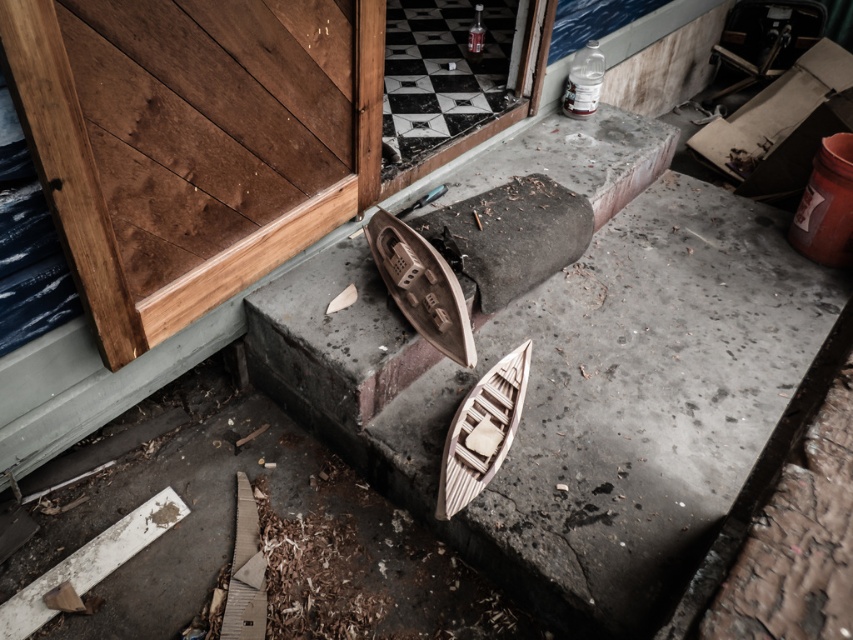
Question: Among these points, which one is farthest from the camera?

Choices:
 (A) coord(662,205)
 (B) coord(447,438)
 (C) coord(366,147)
 (D) coord(439,4)

Answer: (D)

Question: Observing the image, what is the correct spatial positioning of wooden door at left in reference to black glass screen door at upper center?

Choices:
 (A) above
 (B) below

Answer: (B)

Question: Does smooth concrete boat at center lie behind wooden door at left?

Choices:
 (A) no
 (B) yes

Answer: (B)

Question: Among these points, which one is nearest to the camera?

Choices:
 (A) (526, 58)
 (B) (508, 417)

Answer: (B)

Question: Which object appears closest to the camera in this image?

Choices:
 (A) wooden boat at center
 (B) smooth concrete boat at center
 (C) black glass screen door at upper center
 (D) wooden door at left

Answer: (D)

Question: Does smooth concrete boat at center appear over wooden door at left?

Choices:
 (A) no
 (B) yes

Answer: (A)